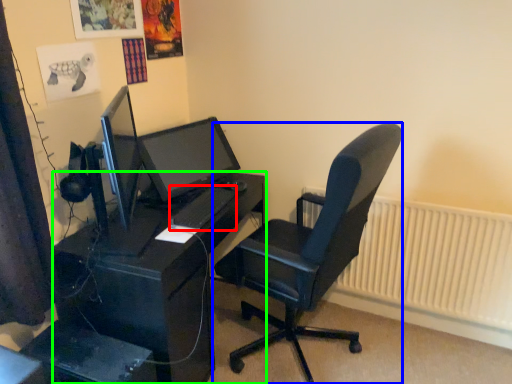
Question: Which is nearer to the keyboard (highlighted by a red box)? chair (highlighted by a blue box) or desk (highlighted by a green box).

Choices:
 (A) chair
 (B) desk

Answer: (B)